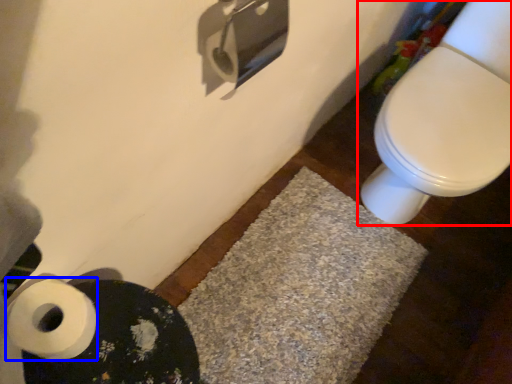
Question: Which object is further to the camera taking this photo, toilet (highlighted by a red box) or toilet paper (highlighted by a blue box)?

Choices:
 (A) toilet
 (B) toilet paper

Answer: (A)